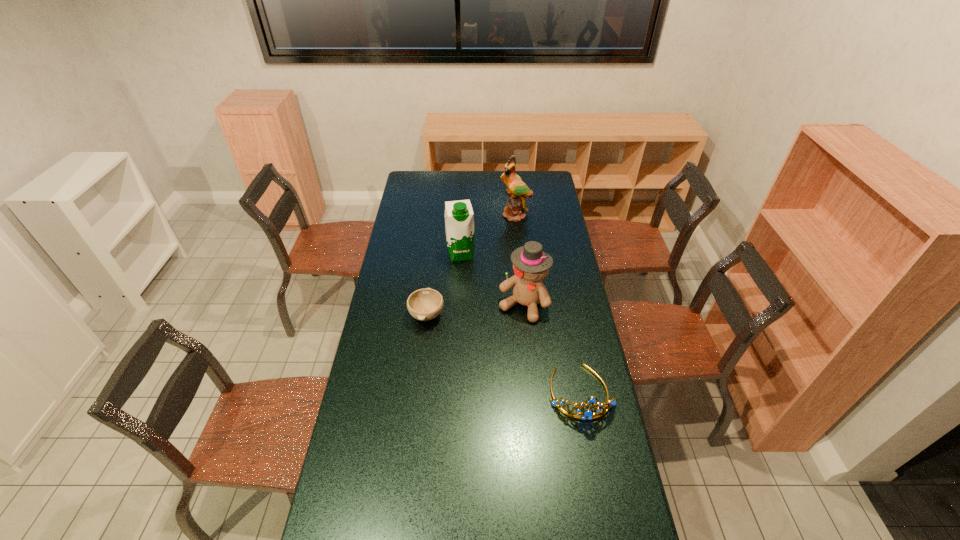
Image resolution: width=960 pixels, height=540 pixels. Find the location of `vacant spot on the desktop that is between the shortest object and the fourth tallest object and is positioned on the front-facing side of the parrot`. vacant spot on the desktop that is between the shortest object and the fourth tallest object and is positioned on the front-facing side of the parrot is located at coordinates (490, 346).

The image size is (960, 540). Identify the location of vacant space on the desktop that is between the bowl and the nearest object and is positioned on the front-facing side of the rag_doll. (498, 350).

The width and height of the screenshot is (960, 540). I want to click on vacant space on the desktop that is between the shortest object and the tiara and is positioned on the front-facing side of the soya milk, so click(x=480, y=341).